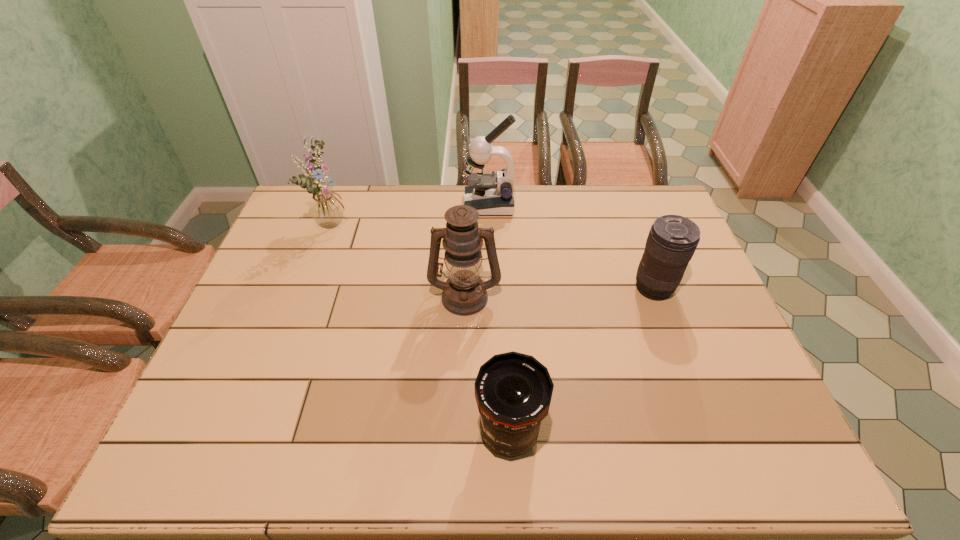
Where is `vacant area at the far edge of the desktop`? The height and width of the screenshot is (540, 960). vacant area at the far edge of the desktop is located at coordinates (553, 226).

The height and width of the screenshot is (540, 960). Find the location of `vacant space at the near edge of the desktop`. vacant space at the near edge of the desktop is located at coordinates (706, 452).

This screenshot has height=540, width=960. I want to click on vacant region at the left edge of the desktop, so click(x=308, y=257).

This screenshot has height=540, width=960. In the image, there is a desktop. In order to click on free space at the far left corner in this screenshot , I will do `click(300, 188)`.

Locate an element on the screen. The height and width of the screenshot is (540, 960). blank space at the far right corner of the desktop is located at coordinates (631, 186).

Locate an element on the screen. The height and width of the screenshot is (540, 960). vacant space in between the bouquet and the oil lamp is located at coordinates (399, 259).

This screenshot has height=540, width=960. What are the coordinates of `unoccupied area between the rightmost object and the microscope` in the screenshot? It's located at (571, 246).

You are a GUI agent. You are given a task and a screenshot of the screen. Output one action in this format:
    pyautogui.click(x=<x>, y=<y>)
    Task: Click on the free space between the oil lamp and the farther telephoto lens
    The image size is (960, 540).
    Given the screenshot: What is the action you would take?
    (559, 292)

In order to click on empty space that is in between the bouquet and the oil lamp in this screenshot , I will do `click(399, 259)`.

You are a GUI agent. You are given a task and a screenshot of the screen. Output one action in this format:
    pyautogui.click(x=<x>, y=<y>)
    Task: Click on the vacant area between the microscope and the nearer telephoto lens
    
    Given the screenshot: What is the action you would take?
    pyautogui.click(x=499, y=319)